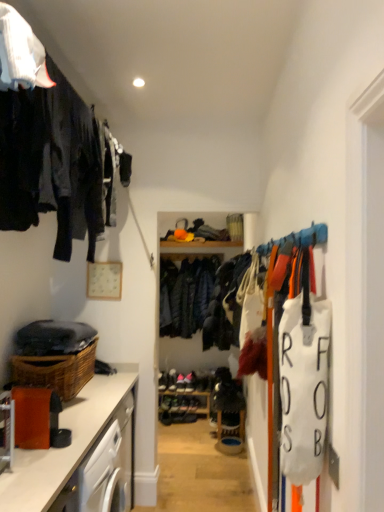
Question: Is dark blue woolen jacket at center located within shiny black shoe at center, placed as the 3th shoe when sorted from top to bottom?

Choices:
 (A) no
 (B) yes

Answer: (A)

Question: Does shiny black shoe at center, placed as the 3th shoe when sorted from top to bottom, appear on the left side of dark blue woolen jacket at center?

Choices:
 (A) no
 (B) yes

Answer: (B)

Question: Is shiny black shoe at center, placed as the 3th shoe when sorted from top to bottom, not inside dark blue woolen jacket at center?

Choices:
 (A) yes
 (B) no

Answer: (A)

Question: Does shiny black shoe at center, which is the 2th shoe in bottom-to-top order, appear on the right side of dark blue woolen jacket at center?

Choices:
 (A) no
 (B) yes

Answer: (A)

Question: Does shiny black shoe at center, placed as the 3th shoe when sorted from top to bottom, have a greater width compared to dark blue woolen jacket at center?

Choices:
 (A) yes
 (B) no

Answer: (B)

Question: Looking at the image, does wooden shelf at center seem bigger or smaller compared to leather shoe at center, marked as the fourth shoe in a bottom-to-top arrangement?

Choices:
 (A) big
 (B) small

Answer: (A)

Question: Considering the positions of wooden shelf at center and leather shoe at center, marked as the fourth shoe in a bottom-to-top arrangement, in the image, is wooden shelf at center taller or shorter than leather shoe at center, marked as the fourth shoe in a bottom-to-top arrangement,?

Choices:
 (A) tall
 (B) short

Answer: (A)

Question: From a real-world perspective, relative to leather shoe at center, placed as the 1th shoe when sorted from top to bottom, is wooden shelf at center vertically above or below?

Choices:
 (A) below
 (B) above

Answer: (A)

Question: Considering the positions of wooden shelf at center and leather shoe at center, placed as the 1th shoe when sorted from top to bottom, in the image, is wooden shelf at center wider or thinner than leather shoe at center, placed as the 1th shoe when sorted from top to bottom,?

Choices:
 (A) wide
 (B) thin

Answer: (A)

Question: From the image's perspective, is matte brown countertop at lower left positioned above or below wooden shelf at center?

Choices:
 (A) above
 (B) below

Answer: (A)

Question: Considering the positions of point (69, 465) and point (182, 394), is point (69, 465) closer or farther from the camera than point (182, 394)?

Choices:
 (A) closer
 (B) farther

Answer: (A)

Question: Considering the positions of matte brown countertop at lower left and wooden shelf at center in the image, is matte brown countertop at lower left taller or shorter than wooden shelf at center?

Choices:
 (A) tall
 (B) short

Answer: (A)

Question: Is matte brown countertop at lower left situated inside wooden shelf at center or outside?

Choices:
 (A) inside
 (B) outside

Answer: (B)

Question: Is dark blue woolen jacket at center inside the boundaries of shiny black shoe at center, which is the 2th shoe in bottom-to-top order, or outside?

Choices:
 (A) outside
 (B) inside

Answer: (A)

Question: Considering the relative positions of dark blue woolen jacket at center and shiny black shoe at center, placed as the 3th shoe when sorted from top to bottom, in the image provided, is dark blue woolen jacket at center to the left or to the right of shiny black shoe at center, placed as the 3th shoe when sorted from top to bottom,?

Choices:
 (A) right
 (B) left

Answer: (A)